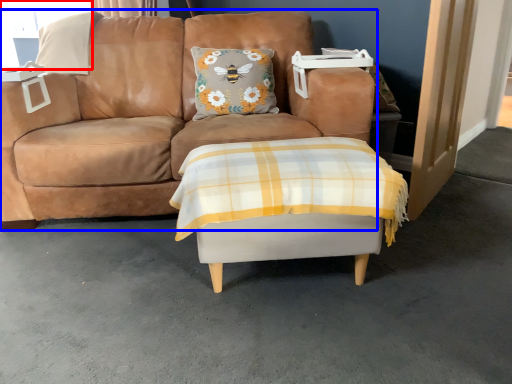
Question: Which object appears closest to the camera in this image, window screen (highlighted by a red box) or studio couch (highlighted by a blue box)?

Choices:
 (A) window screen
 (B) studio couch

Answer: (B)